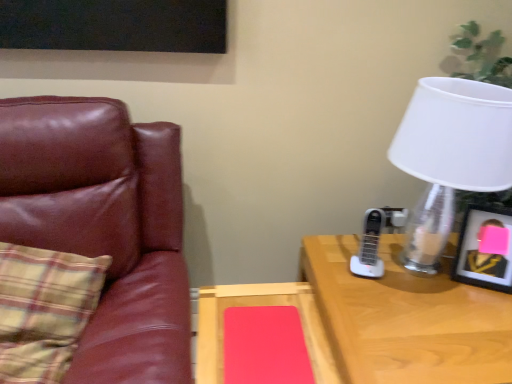
The height and width of the screenshot is (384, 512). Describe the element at coordinates (262, 335) in the screenshot. I see `matte wood table at center` at that location.

You are a GUI agent. You are given a task and a screenshot of the screen. Output one action in this format:
    pyautogui.click(x=<x>, y=<y>)
    Task: Click on the wooden desk at right
    This screenshot has width=512, height=384.
    Given the screenshot: What is the action you would take?
    pyautogui.click(x=406, y=319)

Which is behind, point (496, 170) or point (452, 275)?

The point (452, 275) is behind.

Is white matte lampshade at upper right facing away from metallic silver picture frame at right?

No, white matte lampshade at upper right is not facing away from metallic silver picture frame at right.

Are white matte lampshade at upper right and metallic silver picture frame at right far apart?

No, white matte lampshade at upper right is in close proximity to metallic silver picture frame at right.

Looking at their sizes, would you say leather couch at left is wider or thinner than plaid fabric pillow at left?

In the image, leather couch at left appears to be wider than plaid fabric pillow at left.

From the image's perspective, is leather couch at left over plaid fabric pillow at left?

Actually, leather couch at left appears below plaid fabric pillow at left in the image.

Which is more to the right, leather couch at left or plaid fabric pillow at left?

Positioned to the right is leather couch at left.

Is leather couch at left oriented away from plaid fabric pillow at left?

Yes, leather couch at left is facing away from plaid fabric pillow at left.

Is wooden desk at right inside or outside of matte wood table at center?

wooden desk at right is located beyond the bounds of matte wood table at center.

Looking at this image, does wooden desk at right appear on the right side of matte wood table at center?

Yes, wooden desk at right is to the right of matte wood table at center.

The image size is (512, 384). I want to click on table below the wooden desk at right (from the image's perspective), so click(x=262, y=335).

Is wooden desk at right closer to the viewer compared to matte wood table at center?

Yes, it is.

Is white matte lampshade at upper right located within metallic silver picture frame at right?

No, white matte lampshade at upper right is located outside of metallic silver picture frame at right.

Find the location of a particular element. lamp in front of the metallic silver picture frame at right is located at coordinates (450, 155).

Is metallic silver picture frame at right at the left side of white matte lampshade at upper right?

No.

Is metallic silver picture frame at right oriented towards white matte lampshade at upper right?

Yes, metallic silver picture frame at right is turned towards white matte lampshade at upper right.

How different are the orientations of matte wood table at center and wooden desk at right in degrees?

1.08 degrees.

Does matte wood table at center turn towards wooden desk at right?

No, matte wood table at center is not aimed at wooden desk at right.

In terms of width, does matte wood table at center look wider or thinner when compared to wooden desk at right?

matte wood table at center is thinner than wooden desk at right.

Is matte wood table at center positioned in front of wooden desk at right?

No, it is not.

From the image's perspective, relative to white matte lampshade at upper right, is matte wood table at center above or below?

From the image's perspective, matte wood table at center appears below white matte lampshade at upper right.

From the picture: Is matte wood table at center to the left or to the right of white matte lampshade at upper right in the image?

Clearly, matte wood table at center is on the left of white matte lampshade at upper right in the image.

From the image's perspective, which is below, plaid fabric pillow at left or metallic silver picture frame at right?

From the image's view, plaid fabric pillow at left is below.

Considering their positions, is plaid fabric pillow at left located in front of or behind metallic silver picture frame at right?

plaid fabric pillow at left is in front of metallic silver picture frame at right.

Would you say plaid fabric pillow at left is outside metallic silver picture frame at right?

plaid fabric pillow at left is positioned outside metallic silver picture frame at right.

Looking at the image, does plaid fabric pillow at left seem bigger or smaller compared to metallic silver picture frame at right?

Considering their sizes, plaid fabric pillow at left takes up more space than metallic silver picture frame at right.

Image resolution: width=512 pixels, height=384 pixels. I want to click on picture frame behind the white matte lampshade at upper right, so click(x=485, y=249).

Find the location of `pillow to the left of leather couch at left`. pillow to the left of leather couch at left is located at coordinates (44, 310).

Looking at the image, which one is located further to wooden desk at right, white matte lampshade at upper right or plaid fabric pillow at left?

plaid fabric pillow at left is positioned further to the anchor wooden desk at right.

Estimate the real-world distances between objects in this image. Which object is further from matte wood table at center, plaid fabric pillow at left or metallic silver picture frame at right?

metallic silver picture frame at right lies further to matte wood table at center than the other object.

Estimate the real-world distances between objects in this image. Which object is closer to plaid fabric pillow at left, wooden desk at right or white matte lampshade at upper right?

wooden desk at right lies closer to plaid fabric pillow at left than the other object.

Based on their spatial positions, is matte wood table at center or wooden desk at right closer to white matte lampshade at upper right?

wooden desk at right lies closer to white matte lampshade at upper right than the other object.

Which object lies nearer to the anchor point plaid fabric pillow at left, white matte lampshade at upper right or metallic silver picture frame at right?

white matte lampshade at upper right lies closer to plaid fabric pillow at left than the other object.

Based on their spatial positions, is white matte lampshade at upper right or matte wood table at center closer to wooden desk at right?

matte wood table at center is closer to wooden desk at right.

Which object lies nearer to the anchor point wooden desk at right, metallic silver picture frame at right or white matte lampshade at upper right?

metallic silver picture frame at right lies closer to wooden desk at right than the other object.

Based on their spatial positions, is leather couch at left or wooden desk at right closer to metallic silver picture frame at right?

wooden desk at right.

Image resolution: width=512 pixels, height=384 pixels. I want to click on picture frame that lies between white matte lampshade at upper right and wooden desk at right from top to bottom, so click(485, 249).

You are a GUI agent. You are given a task and a screenshot of the screen. Output one action in this format:
    pyautogui.click(x=<x>, y=<y>)
    Task: Click on the table between plaid fabric pillow at left and wooden desk at right in the horizontal direction
    This screenshot has height=384, width=512.
    Given the screenshot: What is the action you would take?
    pyautogui.click(x=262, y=335)

What are the coordinates of `table situated between leather couch at left and white matte lampshade at upper right from left to right` in the screenshot? It's located at (262, 335).

Identify the location of chair located between plaid fabric pillow at left and white matte lampshade at upper right in the left-right direction. (104, 225).